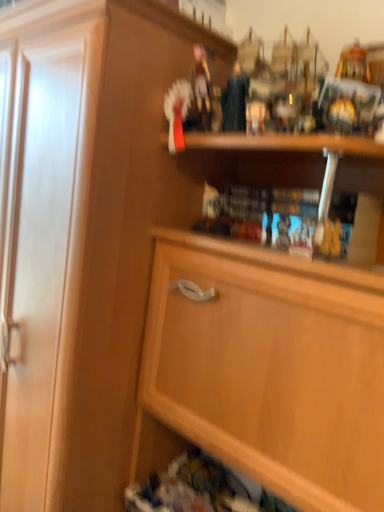
Question: From the image's perspective, is hardcover book at center positioned above or below wooden cabinet at upper center?

Choices:
 (A) above
 (B) below

Answer: (A)

Question: Looking at their shapes, would you say hardcover book at center is wider or thinner than wooden cabinet at upper center?

Choices:
 (A) wide
 (B) thin

Answer: (B)

Question: Is point (276, 216) positioned closer to the camera than point (331, 365)?

Choices:
 (A) closer
 (B) farther

Answer: (B)

Question: In terms of size, does wooden cabinet at upper center appear bigger or smaller than hardcover book at center?

Choices:
 (A) big
 (B) small

Answer: (A)

Question: Considering the relative positions of wooden cabinet at upper center and hardcover book at center in the image provided, is wooden cabinet at upper center to the left or to the right of hardcover book at center?

Choices:
 (A) right
 (B) left

Answer: (B)

Question: In terms of width, does wooden cabinet at upper center look wider or thinner when compared to hardcover book at center?

Choices:
 (A) wide
 (B) thin

Answer: (A)

Question: Relative to hardcover book at center, is wooden cabinet at upper center in front or behind?

Choices:
 (A) behind
 (B) front

Answer: (B)